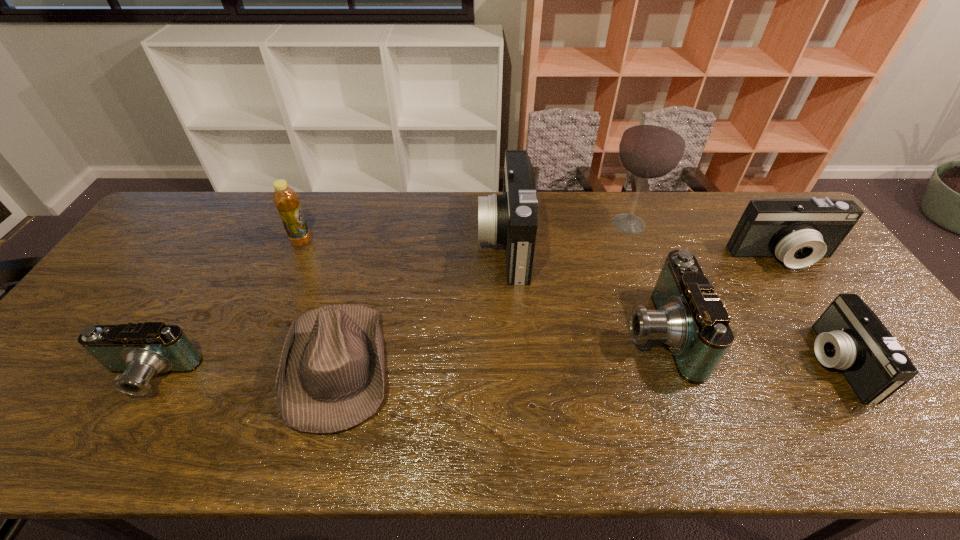
Choose which black camcorder is the nearest neighbor to the bottle. Please provide its 2D coordinates. Your answer should be formatted as a tuple, i.e. [(x, y)], where the tuple contains the x and y coordinates of a point satisfying the conditions above.

[(510, 218)]

At what (x,y) coordinates should I click in order to perform the action: click on free space that satisfies the following two spatial constraints: 1. on the lens of the second biggest black camcorder; 2. on the front-facing side of the right blue camcorder. Please return your answer as a coordinate pair (x, y). Looking at the image, I should click on (834, 333).

This screenshot has width=960, height=540. In order to click on blank space that satisfies the following two spatial constraints: 1. on the lens of the second biggest black camcorder; 2. on the lens of the nearest black camcorder in this screenshot , I will do `click(854, 363)`.

Where is `free space that satisfies the following two spatial constraints: 1. on the front-facing side of the third camcorder from left to right; 2. on the front-facing side of the smaller blue camcorder`? The width and height of the screenshot is (960, 540). free space that satisfies the following two spatial constraints: 1. on the front-facing side of the third camcorder from left to right; 2. on the front-facing side of the smaller blue camcorder is located at coordinates (673, 377).

Identify the location of blank space that satisfies the following two spatial constraints: 1. on the lens of the second smallest black camcorder; 2. on the lens of the nearest black camcorder. This screenshot has height=540, width=960. (854, 363).

Identify the location of free location that satisfies the following two spatial constraints: 1. on the lens of the tallest camcorder; 2. on the front-facing side of the leftmost object. (513, 377).